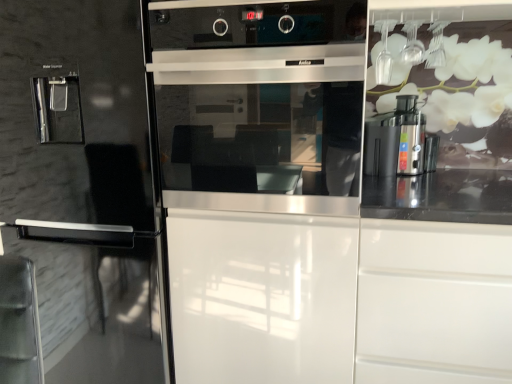
Question: Is satin silver coffee machine at right positioned with its back to white glossy drawer at right?

Choices:
 (A) yes
 (B) no

Answer: (B)

Question: Is satin silver coffee machine at right outside white glossy drawer at right?

Choices:
 (A) yes
 (B) no

Answer: (A)

Question: Would you say satin silver coffee machine at right is a long distance from white glossy drawer at right?

Choices:
 (A) no
 (B) yes

Answer: (A)

Question: Considering the relative sizes of satin silver coffee machine at right and white glossy drawer at right in the image provided, is satin silver coffee machine at right bigger than white glossy drawer at right?

Choices:
 (A) yes
 (B) no

Answer: (B)

Question: Considering the relative positions of satin silver coffee machine at right and white glossy drawer at right in the image provided, is satin silver coffee machine at right in front of white glossy drawer at right?

Choices:
 (A) yes
 (B) no

Answer: (B)

Question: In terms of size, does satin silver oven at center appear bigger or smaller than satin silver coffee machine at right?

Choices:
 (A) small
 (B) big

Answer: (B)

Question: Looking at their shapes, would you say satin silver oven at center is wider or thinner than satin silver coffee machine at right?

Choices:
 (A) wide
 (B) thin

Answer: (A)

Question: Is satin silver oven at center to the left or to the right of satin silver coffee machine at right in the image?

Choices:
 (A) right
 (B) left

Answer: (B)

Question: From a real-world perspective, is satin silver oven at center above or below satin silver coffee machine at right?

Choices:
 (A) above
 (B) below

Answer: (A)

Question: Considering their positions, is glossy black fridge at left located in front of or behind satin silver coffee machine at right?

Choices:
 (A) front
 (B) behind

Answer: (A)

Question: Is glossy black fridge at left bigger or smaller than satin silver coffee machine at right?

Choices:
 (A) big
 (B) small

Answer: (A)

Question: From the image's perspective, relative to satin silver coffee machine at right, is glossy black fridge at left above or below?

Choices:
 (A) above
 (B) below

Answer: (B)

Question: Do you think glossy black fridge at left is within satin silver coffee machine at right, or outside of it?

Choices:
 (A) inside
 (B) outside

Answer: (B)

Question: Based on their sizes in the image, would you say satin silver coffee machine at right is bigger or smaller than white glossy drawer at right?

Choices:
 (A) small
 (B) big

Answer: (A)

Question: Considering the positions of satin silver coffee machine at right and white glossy drawer at right in the image, is satin silver coffee machine at right taller or shorter than white glossy drawer at right?

Choices:
 (A) tall
 (B) short

Answer: (B)